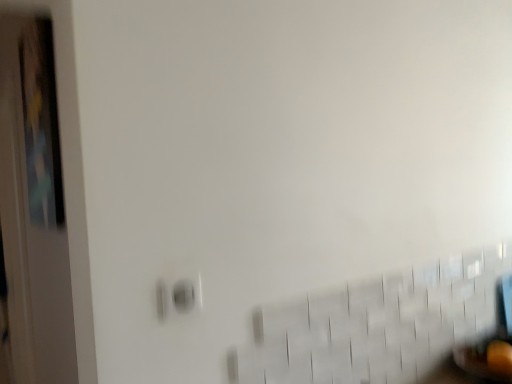
Question: Based on their positions, is wooden door at left located to the left or right of matte white electric outlet at lower left?

Choices:
 (A) right
 (B) left

Answer: (B)

Question: Considering the positions of point (42, 254) and point (168, 286), is point (42, 254) closer or farther from the camera than point (168, 286)?

Choices:
 (A) farther
 (B) closer

Answer: (A)

Question: Considering the positions of wooden door at left and matte white electric outlet at lower left in the image, is wooden door at left wider or thinner than matte white electric outlet at lower left?

Choices:
 (A) thin
 (B) wide

Answer: (B)

Question: Is matte white electric outlet at lower left inside or outside of wooden door at left?

Choices:
 (A) inside
 (B) outside

Answer: (B)

Question: From the image's perspective, is matte white electric outlet at lower left located above or below wooden door at left?

Choices:
 (A) above
 (B) below

Answer: (A)

Question: Is point (181, 278) positioned closer to the camera than point (19, 178)?

Choices:
 (A) closer
 (B) farther

Answer: (A)

Question: Based on their positions, is matte white electric outlet at lower left located to the left or right of wooden door at left?

Choices:
 (A) left
 (B) right

Answer: (B)